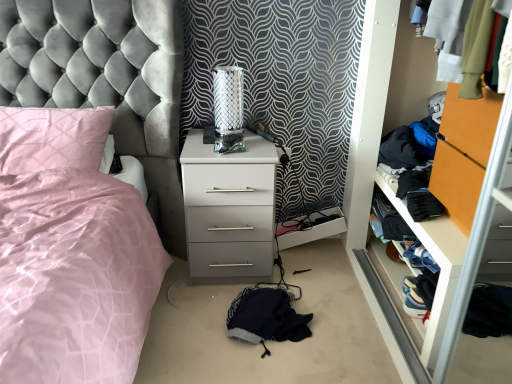
I want to click on vacant space behind fuzzy dark blue blanket at lower center, the third clothing from the right, so click(x=295, y=275).